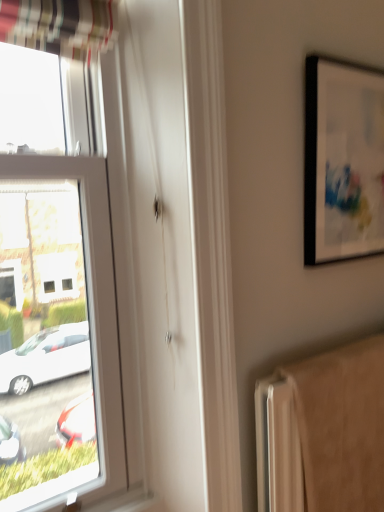
The height and width of the screenshot is (512, 384). I want to click on beige fabric radiator at lower right, so 323,432.

Describe the element at coordinates (323, 432) in the screenshot. I see `beige fabric radiator at lower right` at that location.

What do you see at coordinates (343, 160) in the screenshot?
I see `black matte picture frame at upper right` at bounding box center [343, 160].

Locate an element on the screen. The height and width of the screenshot is (512, 384). black matte picture frame at upper right is located at coordinates (343, 160).

Identify the location of beige fabric radiator at lower right. [x=323, y=432].

Does beige fabric radiator at lower right appear on the right side of black matte picture frame at upper right?

In fact, beige fabric radiator at lower right is to the left of black matte picture frame at upper right.

In the image, is beige fabric radiator at lower right positioned in front of or behind black matte picture frame at upper right?

beige fabric radiator at lower right is in front of black matte picture frame at upper right.

Between point (354, 393) and point (324, 238), which one is positioned in front?

Point (354, 393)

From the image's perspective, which is below, beige fabric radiator at lower right or black matte picture frame at upper right?

beige fabric radiator at lower right appears lower in the image.

From a real-world perspective, is beige fabric radiator at lower right beneath black matte picture frame at upper right?

Yes, from a real-world perspective, beige fabric radiator at lower right is beneath black matte picture frame at upper right.

Which of these two, beige fabric radiator at lower right or black matte picture frame at upper right, is wider?

beige fabric radiator at lower right is wider.

Considering the relative sizes of beige fabric radiator at lower right and black matte picture frame at upper right in the image provided, is beige fabric radiator at lower right taller than black matte picture frame at upper right?

Correct, beige fabric radiator at lower right is much taller as black matte picture frame at upper right.

Considering the sizes of beige fabric radiator at lower right and black matte picture frame at upper right in the image, is beige fabric radiator at lower right bigger or smaller than black matte picture frame at upper right?

Clearly, beige fabric radiator at lower right is larger in size than black matte picture frame at upper right.

Is beige fabric radiator at lower right spatially inside black matte picture frame at upper right, or outside of it?

beige fabric radiator at lower right exists outside the volume of black matte picture frame at upper right.

Are beige fabric radiator at lower right and black matte picture frame at upper right located far from each other?

They are positioned close to each other.

Could you tell me if beige fabric radiator at lower right is facing black matte picture frame at upper right?

No.

Can you tell me how much beige fabric radiator at lower right and black matte picture frame at upper right differ in facing direction?

beige fabric radiator at lower right and black matte picture frame at upper right are facing 0.0845 degrees away from each other.

How far apart are beige fabric radiator at lower right and black matte picture frame at upper right?

They are 21.99 inches apart.

In order to click on picture frame behind the beige fabric radiator at lower right in this screenshot , I will do `click(343, 160)`.

Does black matte picture frame at upper right appear on the right side of beige fabric radiator at lower right?

Yes, black matte picture frame at upper right is to the right of beige fabric radiator at lower right.

Considering the positions of objects black matte picture frame at upper right and beige fabric radiator at lower right in the image provided, who is in front, black matte picture frame at upper right or beige fabric radiator at lower right?

Positioned in front is beige fabric radiator at lower right.

Which is in front, point (352, 249) or point (370, 490)?

The point (370, 490) is closer to the camera.

From the image's perspective, which object appears higher, black matte picture frame at upper right or beige fabric radiator at lower right?

From the image's view, black matte picture frame at upper right is above.

From a real-world perspective, between black matte picture frame at upper right and beige fabric radiator at lower right, who is vertically higher?

black matte picture frame at upper right, from a real-world perspective.

Which object is thinner, black matte picture frame at upper right or beige fabric radiator at lower right?

With smaller width is black matte picture frame at upper right.

Consider the image. Between black matte picture frame at upper right and beige fabric radiator at lower right, which one has less height?

black matte picture frame at upper right is shorter.

Considering the sizes of objects black matte picture frame at upper right and beige fabric radiator at lower right in the image provided, who is bigger, black matte picture frame at upper right or beige fabric radiator at lower right?

With larger size is beige fabric radiator at lower right.

Would you say black matte picture frame at upper right contains beige fabric radiator at lower right?

No, beige fabric radiator at lower right is located outside of black matte picture frame at upper right.

Is black matte picture frame at upper right far from beige fabric radiator at lower right?

They are positioned close to each other.

Could you tell me if black matte picture frame at upper right is facing beige fabric radiator at lower right?

No.

Measure the distance between black matte picture frame at upper right and beige fabric radiator at lower right.

black matte picture frame at upper right is 21.99 inches away from beige fabric radiator at lower right.

At what (x,y) coordinates should I click in order to perform the action: click on radiator below the black matte picture frame at upper right (from a real-world perspective). Please return your answer as a coordinate pair (x, y). Image resolution: width=384 pixels, height=512 pixels. Looking at the image, I should click on (323, 432).

You are a GUI agent. You are given a task and a screenshot of the screen. Output one action in this format:
    pyautogui.click(x=<x>, y=<y>)
    Task: Click on the radiator below the black matte picture frame at upper right (from a real-world perspective)
    The width and height of the screenshot is (384, 512).
    Given the screenshot: What is the action you would take?
    pyautogui.click(x=323, y=432)

Locate an element on the screen. radiator that appears in front of the black matte picture frame at upper right is located at coordinates (323, 432).